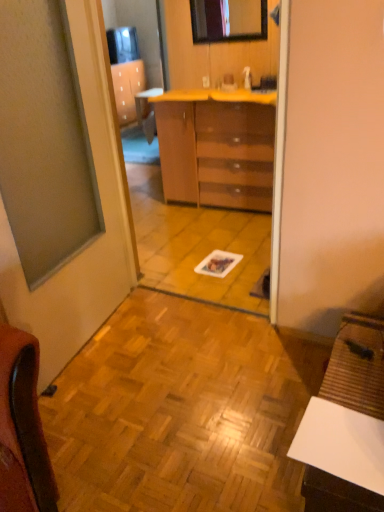
Where is `vacant point above wooden parquet floor at center (from a real-world perspective)`? vacant point above wooden parquet floor at center (from a real-world perspective) is located at coordinates (177, 380).